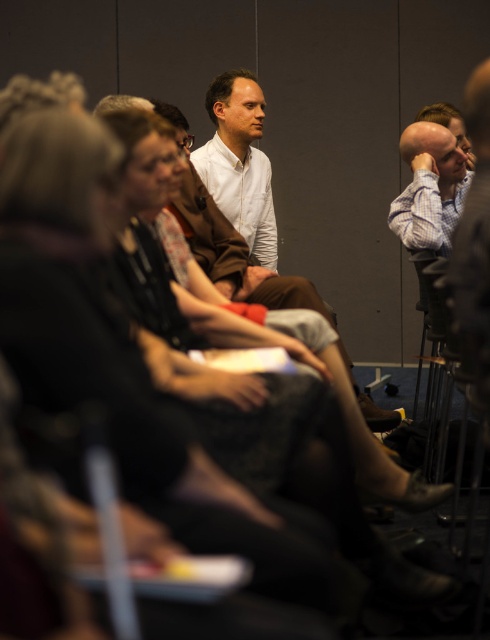
You are sitting in the auditorium and want to determine which of the two points, point (247,124) or point (451,156), is closer to you. Based on the scene description, which point is nearer?

Point (247,124) is further to the camera than point (451,156). Wait, no, the description says the opposite. Let me check again. The Objects Description states that point (247,124) is further to the camera than point (451,156). Therefore, the point closer to the camera is point (451,156). So the answer should be point (451,156) is closer.

You are a service robot with a width of 0.8 meters. You need to move between the white shirt at center and the light blue shirt at right to deliver a document. Is there enough space for you to pass through?

The distance between the white shirt at center and the light blue shirt at right is 1.01 meters. Since the robot is 0.8 meters wide, there is sufficient space for it to pass through the gap.

You are organizing a photo shoot and need to arrange two subjects wearing the white shirt at center and the light blue shirt at right. Given their clothing dimensions, which shirt would require a wider space for the pose you have in mind?

The light blue shirt at right requires a wider space because its width is greater than the white shirt at center.